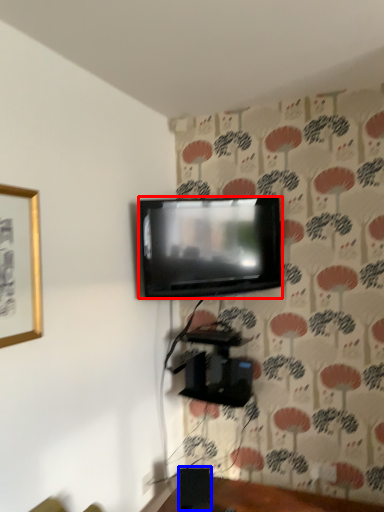
Question: Which point is closer to the camera, television (highlighted by a red box) or speaker (highlighted by a blue box)?

Choices:
 (A) television
 (B) speaker

Answer: (B)